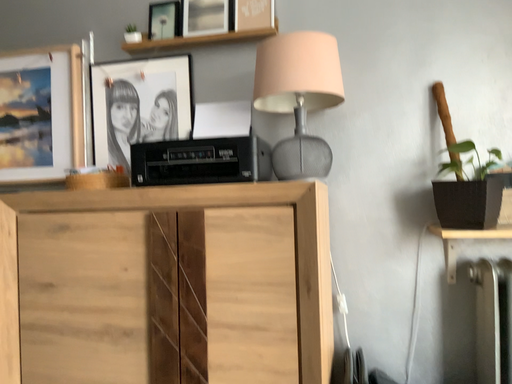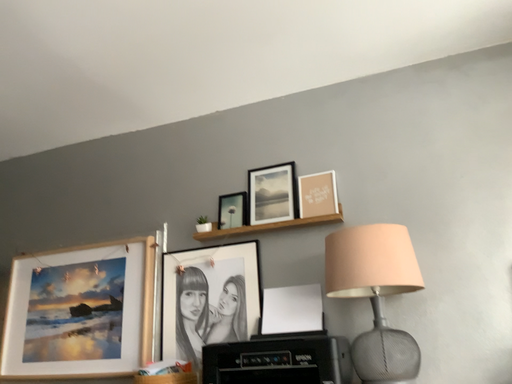
Question: Which way did the camera rotate in the video?

Choices:
 (A) rotated downward
 (B) rotated upward

Answer: (B)